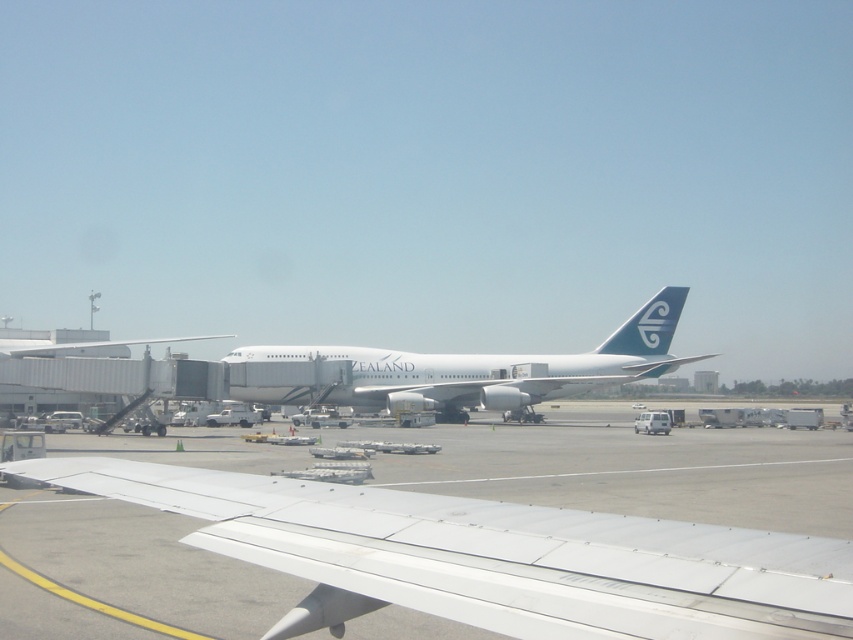
Question: Is white glossy airplane at center to the right of blue glossy tail at center right from the viewer's perspective?

Choices:
 (A) yes
 (B) no

Answer: (B)

Question: Does white matte wing at center appear over blue glossy tail at center right?

Choices:
 (A) no
 (B) yes

Answer: (A)

Question: Considering the real-world distances, which object is farthest from the white glossy airplane at center?

Choices:
 (A) white matte wing at center
 (B) blue glossy tail at center right

Answer: (A)

Question: Which point appears closest to the camera in this image?

Choices:
 (A) (648, 330)
 (B) (268, 358)
 (C) (605, 520)

Answer: (C)

Question: Among these objects, which one is nearest to the camera?

Choices:
 (A) white matte wing at center
 (B) blue glossy tail at center right
 (C) white glossy airplane at center

Answer: (A)

Question: Does white matte wing at center have a larger size compared to blue glossy tail at center right?

Choices:
 (A) yes
 (B) no

Answer: (B)